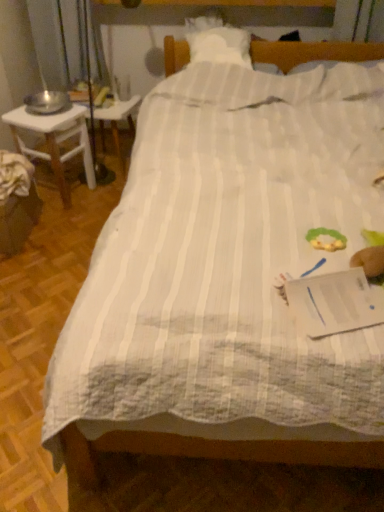
Question: From a real-world perspective, is white plastic table at left above or below white wooden desk at left?

Choices:
 (A) below
 (B) above

Answer: (A)

Question: Considering the positions of white plastic table at left and white wooden desk at left in the image, is white plastic table at left bigger or smaller than white wooden desk at left?

Choices:
 (A) big
 (B) small

Answer: (B)

Question: Is point (115, 138) closer or farther from the camera than point (18, 120)?

Choices:
 (A) farther
 (B) closer

Answer: (A)

Question: Considering the positions of white wooden desk at left and white plastic table at left in the image, is white wooden desk at left bigger or smaller than white plastic table at left?

Choices:
 (A) small
 (B) big

Answer: (B)

Question: In terms of width, does white wooden desk at left look wider or thinner when compared to white plastic table at left?

Choices:
 (A) thin
 (B) wide

Answer: (B)

Question: In terms of height, does white wooden desk at left look taller or shorter compared to white plastic table at left?

Choices:
 (A) tall
 (B) short

Answer: (A)

Question: Is point (64, 158) closer or farther from the camera than point (117, 112)?

Choices:
 (A) closer
 (B) farther

Answer: (B)